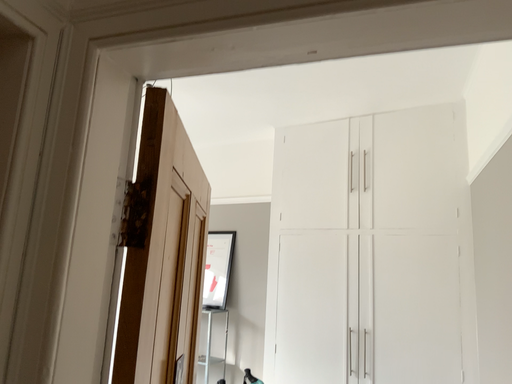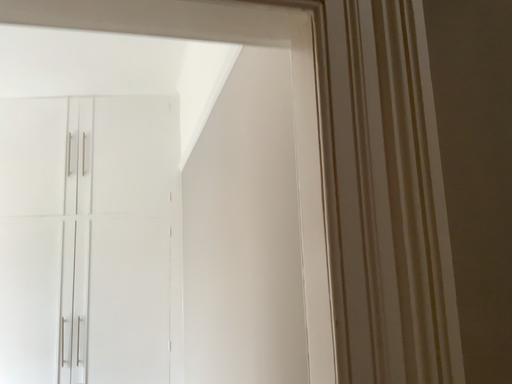
Question: How did the camera likely rotate when shooting the video?

Choices:
 (A) rotated right
 (B) rotated left

Answer: (A)